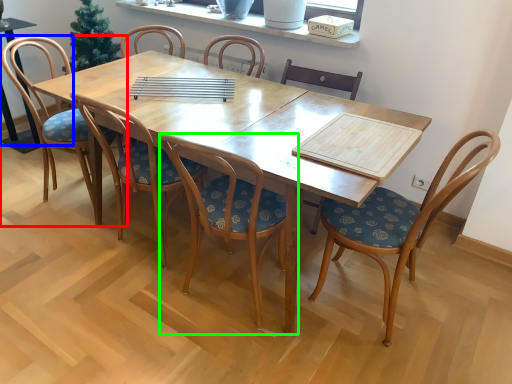
Question: Which object is positioned closest to chair (highlighted by a red box)? Select from armchair (highlighted by a blue box) and chair (highlighted by a green box).

Choices:
 (A) armchair
 (B) chair

Answer: (A)